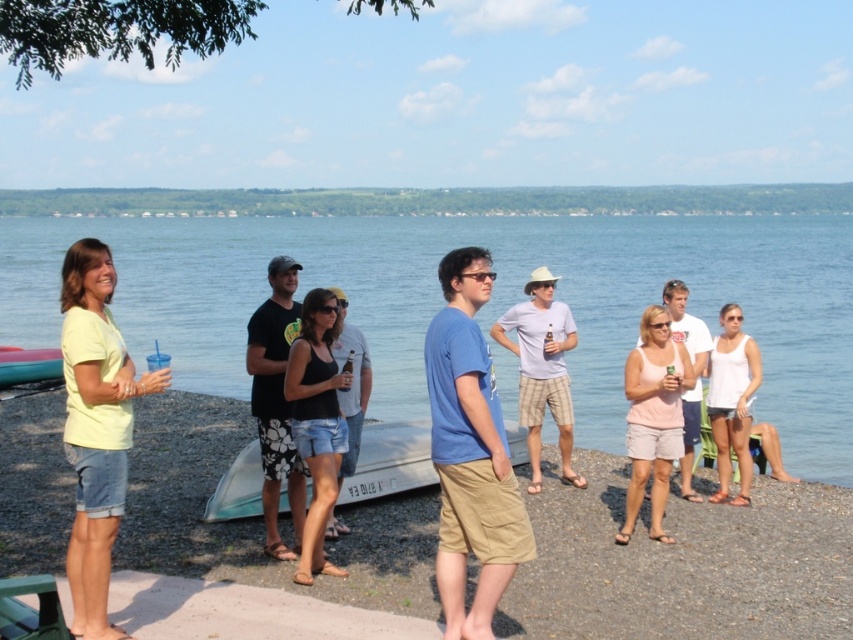
Does black denim shorts at center come in front of translucent plastic kayak at lower left?

That is True.

Does black denim shorts at center lie behind translucent plastic kayak at lower left?

No, black denim shorts at center is closer to the viewer.

Measure the distance between point (x=323, y=337) and camera.

A distance of 6.29 meters exists between point (x=323, y=337) and camera.

At what (x,y) coordinates should I click in order to perform the action: click on black denim shorts at center. Please return your answer as a coordinate pair (x, y). The height and width of the screenshot is (640, 853). Looking at the image, I should click on (316, 420).

Is light gray cotton t-shirt at center above pink cotton tank top at center?

No.

Is point (531, 346) closer to camera compared to point (688, 332)?

No, it is not.

Which is in front, point (550, 273) or point (685, 451)?

Positioned in front is point (685, 451).

Locate an element on the screen. This screenshot has height=640, width=853. light gray cotton t-shirt at center is located at coordinates tap(543, 369).

In the scene shown: Does blue cotton shirt at center appear under white cotton tank top at center-right?

Indeed, blue cotton shirt at center is positioned under white cotton tank top at center-right.

Can you confirm if blue cotton shirt at center is shorter than white cotton tank top at center-right?

No, blue cotton shirt at center is not shorter than white cotton tank top at center-right.

Identify the location of blue cotton shirt at center. (469, 452).